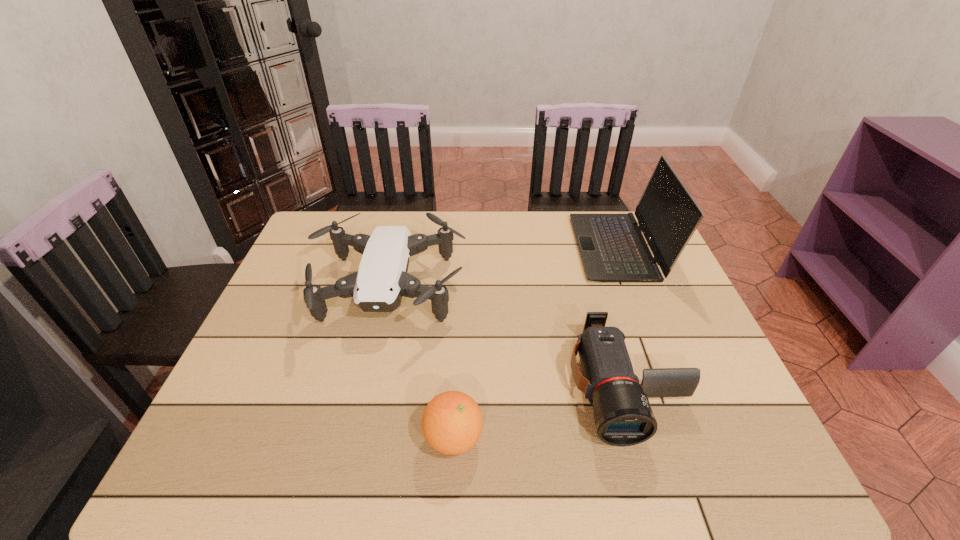
The image size is (960, 540). What are the coordinates of `laptop computer located at the far edge` in the screenshot? It's located at (612, 247).

You are a GUI agent. You are given a task and a screenshot of the screen. Output one action in this format:
    pyautogui.click(x=<x>, y=<y>)
    Task: Click on the drone present at the far edge
    
    Given the screenshot: What is the action you would take?
    pyautogui.click(x=378, y=286)

This screenshot has height=540, width=960. I want to click on camcorder present at the near edge, so click(x=623, y=414).

The image size is (960, 540). I want to click on orange located at the near edge, so click(x=452, y=422).

You are a GUI agent. You are given a task and a screenshot of the screen. Output one action in this format:
    pyautogui.click(x=<x>, y=<y>)
    Task: Click on the object that is at the left edge
    This screenshot has width=960, height=540.
    Given the screenshot: What is the action you would take?
    pyautogui.click(x=378, y=286)

In order to click on laptop computer present at the right edge in this screenshot , I will do `click(612, 247)`.

You are a GUI agent. You are given a task and a screenshot of the screen. Output one action in this format:
    pyautogui.click(x=<x>, y=<y>)
    Task: Click on the camcorder at the right edge
    The image size is (960, 540).
    Given the screenshot: What is the action you would take?
    pyautogui.click(x=623, y=414)

In order to click on object that is at the far left corner in this screenshot , I will do `click(378, 286)`.

Image resolution: width=960 pixels, height=540 pixels. I want to click on object located in the far right corner section of the desktop, so click(x=612, y=247).

The height and width of the screenshot is (540, 960). Identify the location of object that is at the near right corner. (623, 414).